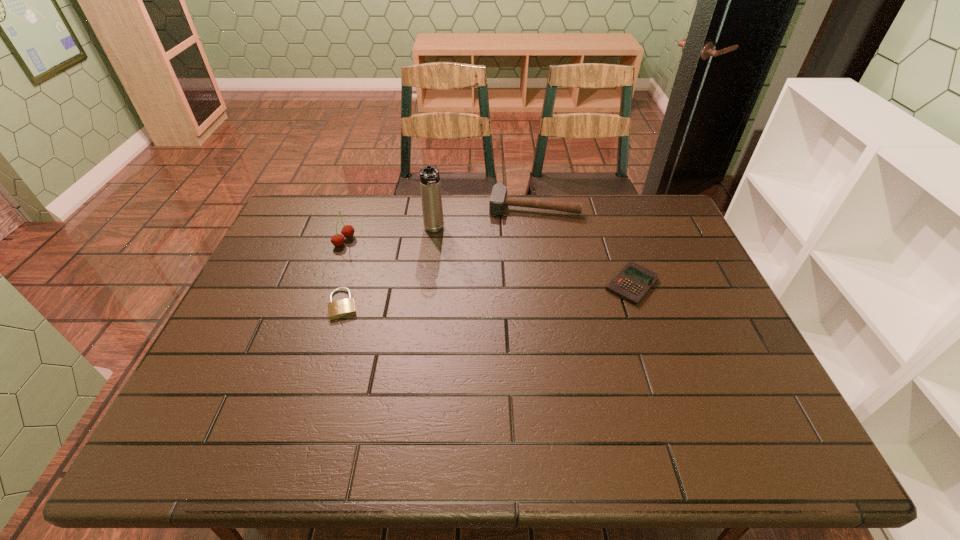
Where is `thermos bottle that is at the far edge`? thermos bottle that is at the far edge is located at coordinates (430, 186).

Locate an element on the screen. The width and height of the screenshot is (960, 540). hammer located at the far edge is located at coordinates (498, 200).

I want to click on object situated at the right edge, so click(632, 283).

In the image, there is a desktop. Find the location of `free region at the far edge`. free region at the far edge is located at coordinates (515, 197).

Image resolution: width=960 pixels, height=540 pixels. I want to click on vacant space at the near edge, so click(375, 405).

Where is `vacant space at the left edge of the desktop`? vacant space at the left edge of the desktop is located at coordinates (216, 349).

At what (x,y) coordinates should I click in order to perform the action: click on vacant space at the right edge of the desktop. Please return your answer as a coordinate pair (x, y). This screenshot has height=540, width=960. Looking at the image, I should click on (752, 363).

This screenshot has width=960, height=540. In the image, there is a desktop. What are the coordinates of `vacant area at the far left corner` in the screenshot? It's located at (327, 198).

Locate an element on the screen. free spot at the far right corner of the desktop is located at coordinates (652, 214).

The width and height of the screenshot is (960, 540). I want to click on free space between the second shortest object and the cherry, so click(488, 263).